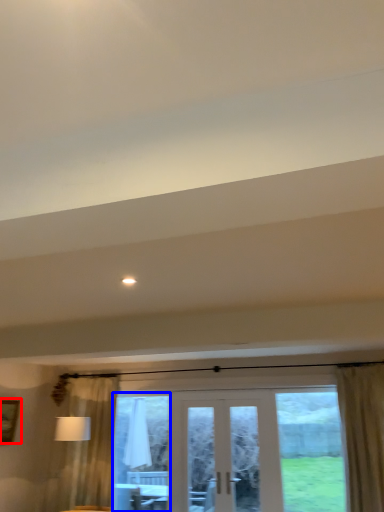
Question: Among these objects, which one is nearest to the camera, picture frame (highlighted by a red box) or window screen (highlighted by a blue box)?

Choices:
 (A) picture frame
 (B) window screen

Answer: (A)